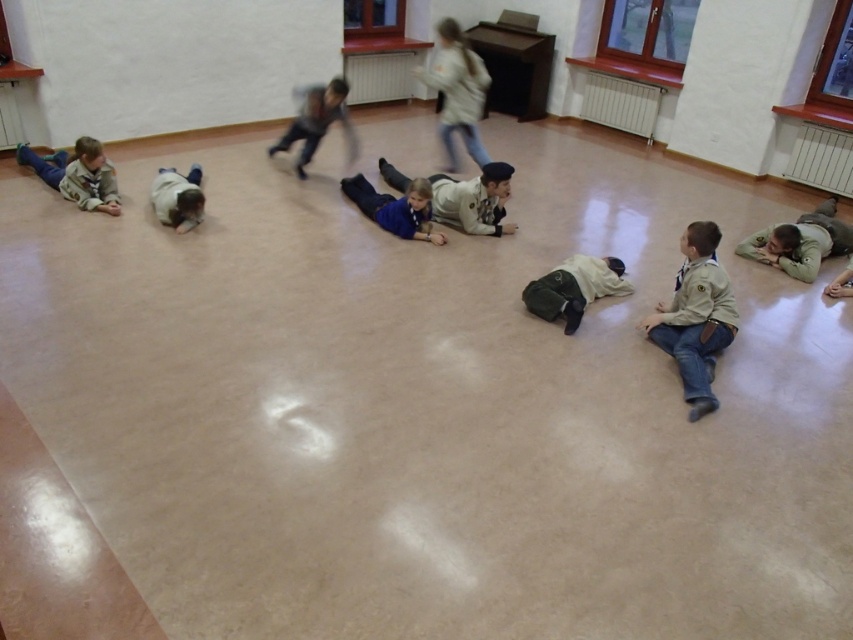
Question: Can you confirm if light beige uniform at upper center is positioned to the right of light brown uniform at left?

Choices:
 (A) no
 (B) yes

Answer: (B)

Question: Which object is farther from the camera taking this photo?

Choices:
 (A) dark green uniform at center
 (B) light blue denim jeans at center
 (C) light beige uniform at upper center
 (D) matte khaki uniform at center

Answer: (B)

Question: Can you confirm if light brown uniform at left is positioned to the left of white matte shirt at lower left?

Choices:
 (A) yes
 (B) no

Answer: (A)

Question: Which point is farther from the camera taking this photo?

Choices:
 (A) (436, 193)
 (B) (422, 192)

Answer: (A)

Question: Does light brown uniform at left come in front of light blue denim jeans at center?

Choices:
 (A) yes
 (B) no

Answer: (A)

Question: Among these objects, which one is nearest to the camera?

Choices:
 (A) light brown uniform at left
 (B) blue matte shirt at center

Answer: (B)